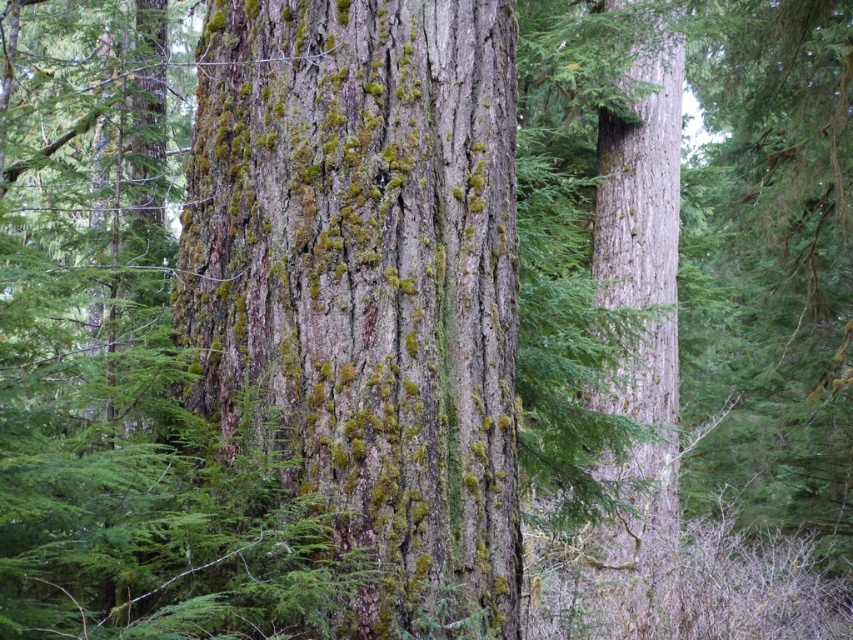
Question: Can you confirm if green mossy bark at center is positioned above smooth gray bark at right?

Choices:
 (A) no
 (B) yes

Answer: (B)

Question: Is green mossy bark at center to the left of smooth gray bark at right from the viewer's perspective?

Choices:
 (A) no
 (B) yes

Answer: (B)

Question: Which point is closer to the camera?

Choices:
 (A) (665, 576)
 (B) (251, 211)

Answer: (B)

Question: Considering the relative positions of green mossy bark at center and smooth gray bark at right in the image provided, where is green mossy bark at center located with respect to smooth gray bark at right?

Choices:
 (A) left
 (B) right

Answer: (A)

Question: Among these objects, which one is farthest from the camera?

Choices:
 (A) green mossy bark at center
 (B) smooth gray bark at right

Answer: (B)